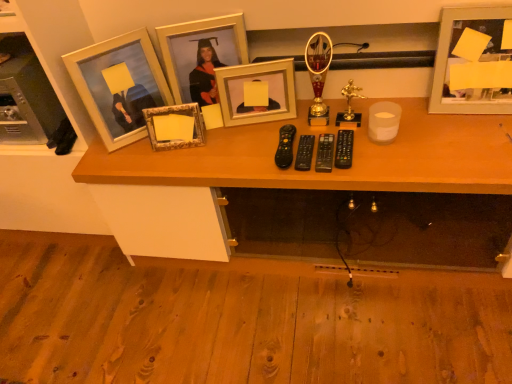
I want to click on spots to the right of gold metallic picture frame at center, marked as the second picture frame in a right-to-left arrangement, so click(x=306, y=117).